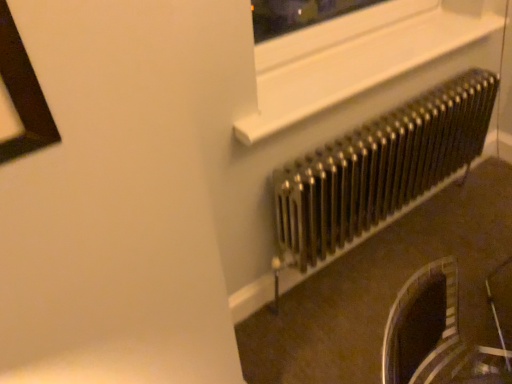
This screenshot has width=512, height=384. In order to click on free space above white plastic window frame at upper center (from a real-world perspective) in this screenshot , I will do `click(354, 52)`.